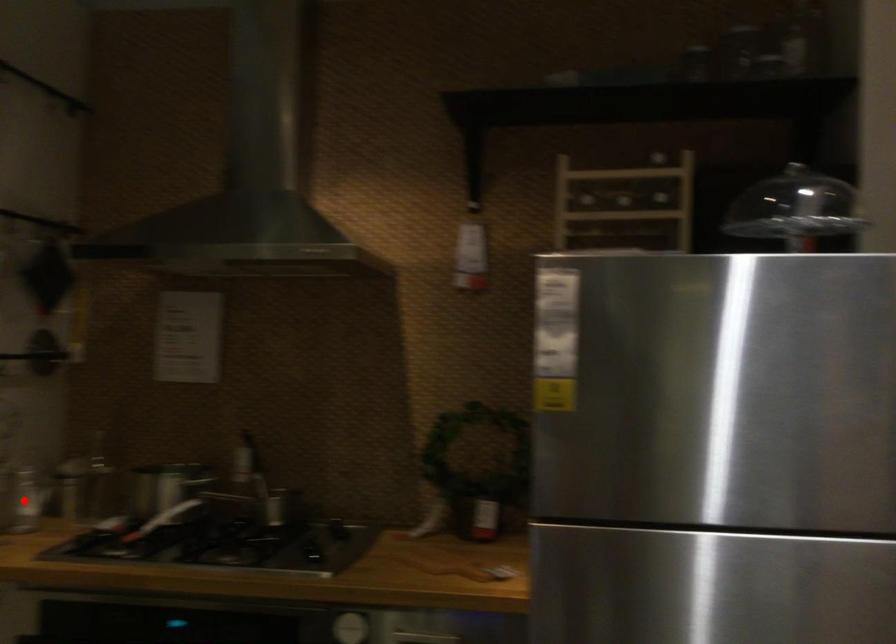
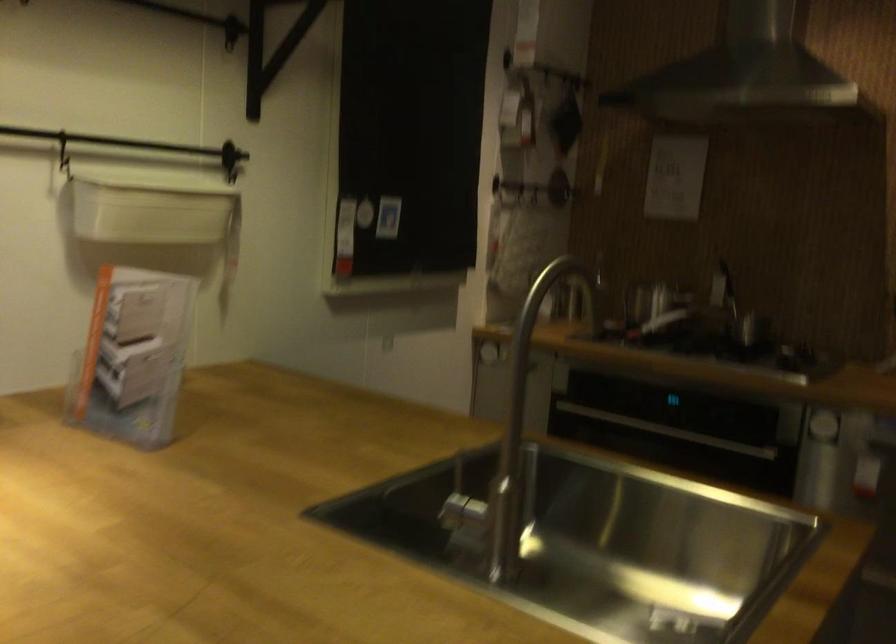
Question: I am providing you with two images of the same scene from different viewpoints. A red point is marked on the first image. At the location where the point appears in image 1, is it still visible in image 2?

Choices:
 (A) Yes
 (B) No

Answer: (B)